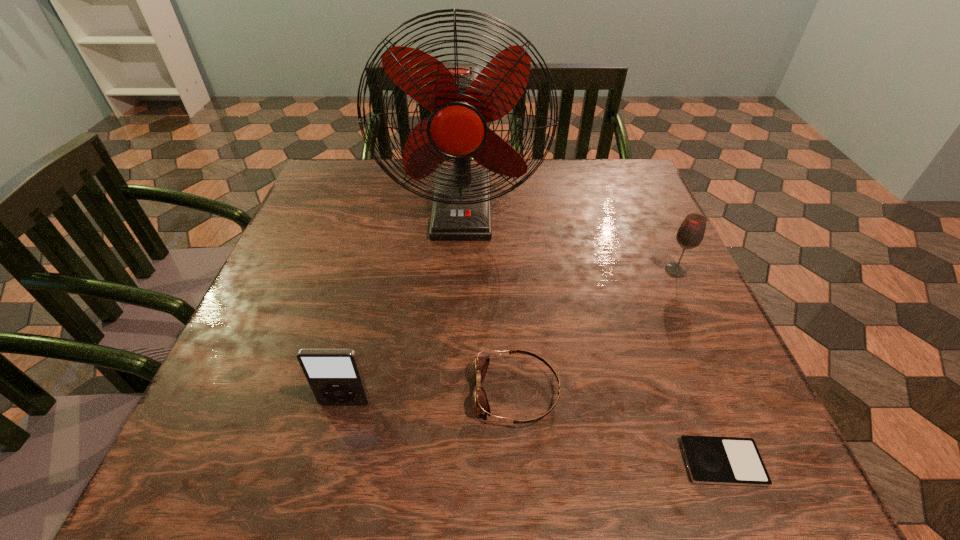
This screenshot has height=540, width=960. I want to click on object at the near right corner, so (710, 460).

Locate an element on the screen. vacant position at the far edge of the desktop is located at coordinates (421, 184).

I want to click on vacant space at the near edge, so click(x=382, y=446).

Where is `free space at the left edge of the desktop`? free space at the left edge of the desktop is located at coordinates (233, 396).

Identify the location of free region at the right edge of the desktop. (704, 383).

At what (x,y) coordinates should I click in order to perform the action: click on vacant position at the far right corner of the desktop. Please return your answer as a coordinate pair (x, y). The height and width of the screenshot is (540, 960). Looking at the image, I should click on (576, 166).

Locate an element on the screen. Image resolution: width=960 pixels, height=540 pixels. free space between the fourth tallest object and the tallest object is located at coordinates (490, 301).

This screenshot has height=540, width=960. In order to click on vacant space in between the farther iPod and the glass drink container in this screenshot , I will do `click(511, 336)`.

The image size is (960, 540). I want to click on free spot between the second shortest object and the farther iPod, so click(x=431, y=397).

Where is `free space between the fourth nearest object and the second shortest object`? free space between the fourth nearest object and the second shortest object is located at coordinates (596, 331).